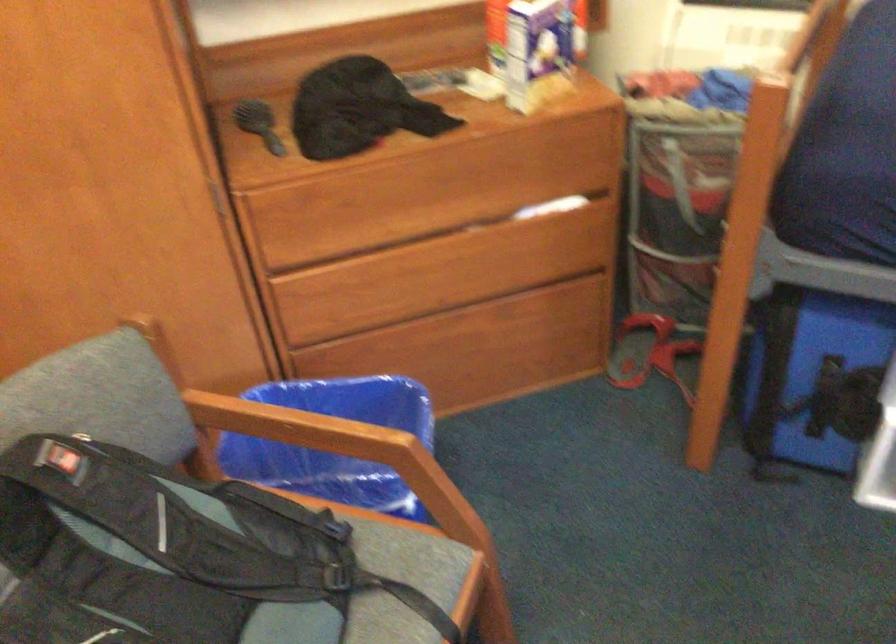
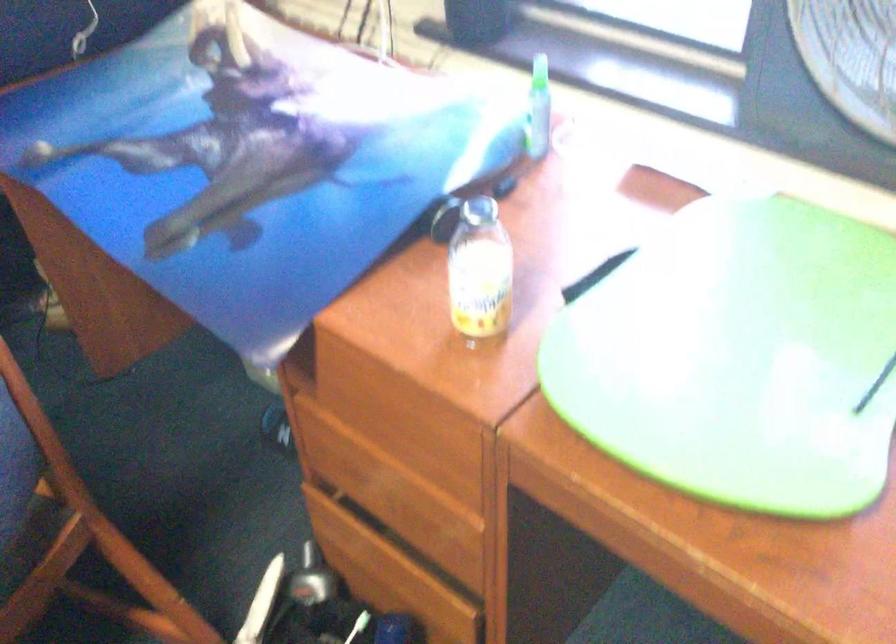
The first image is from the beginning of the video and the second image is from the end. How did the camera likely rotate when shooting the video?

The camera rotated toward right-down.